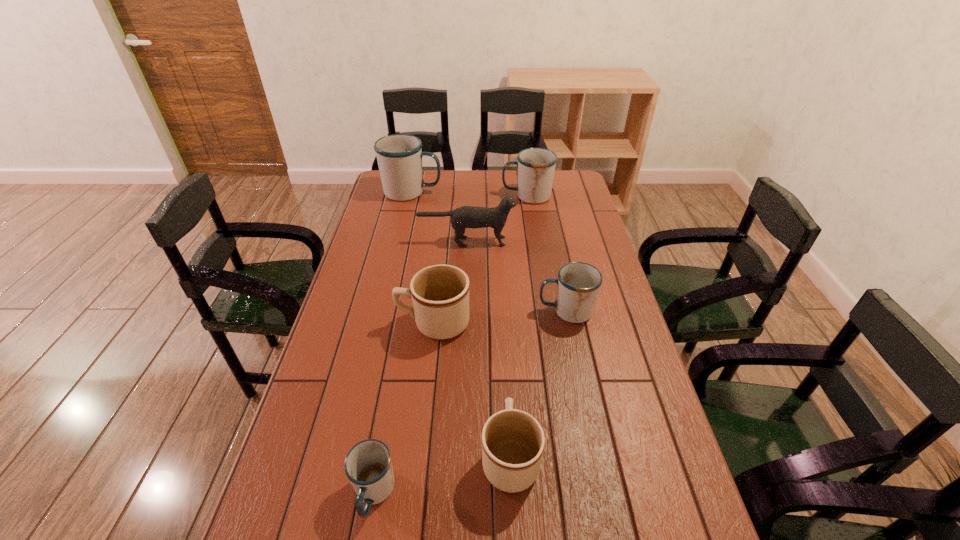
The height and width of the screenshot is (540, 960). I want to click on the smallest white mug, so click(x=368, y=466).

The width and height of the screenshot is (960, 540). I want to click on vacant point located on the handle side of the tallest mug, so click(516, 192).

What are the coordinates of `free space located on the front-facing side of the third farthest object` in the screenshot? It's located at (531, 241).

Find the location of a particular element. The height and width of the screenshot is (540, 960). vacant area situated 0.210m on the handle side of the third smallest white mug is located at coordinates (454, 196).

Where is `vacant position located 0.360m on the handle side of the third smallest white mug`? Image resolution: width=960 pixels, height=540 pixels. vacant position located 0.360m on the handle side of the third smallest white mug is located at coordinates (420, 196).

Where is `vacant space located on the handle side of the third smallest white mug`? The image size is (960, 540). vacant space located on the handle side of the third smallest white mug is located at coordinates (465, 196).

The image size is (960, 540). In order to click on free spot located 0.140m on the side of the left brown mug with the handle in this screenshot , I will do `click(352, 323)`.

At what (x,y) coordinates should I click in order to perform the action: click on vacant region located on the side of the left brown mug with the handle. Please return your answer as a coordinate pair (x, y). Image resolution: width=960 pixels, height=540 pixels. Looking at the image, I should click on (349, 323).

Locate an element on the screen. vacant space situated 0.120m on the side of the left brown mug with the handle is located at coordinates (359, 323).

Where is `vacant area located 0.330m on the handle side of the third farthest white mug`? The height and width of the screenshot is (540, 960). vacant area located 0.330m on the handle side of the third farthest white mug is located at coordinates (434, 311).